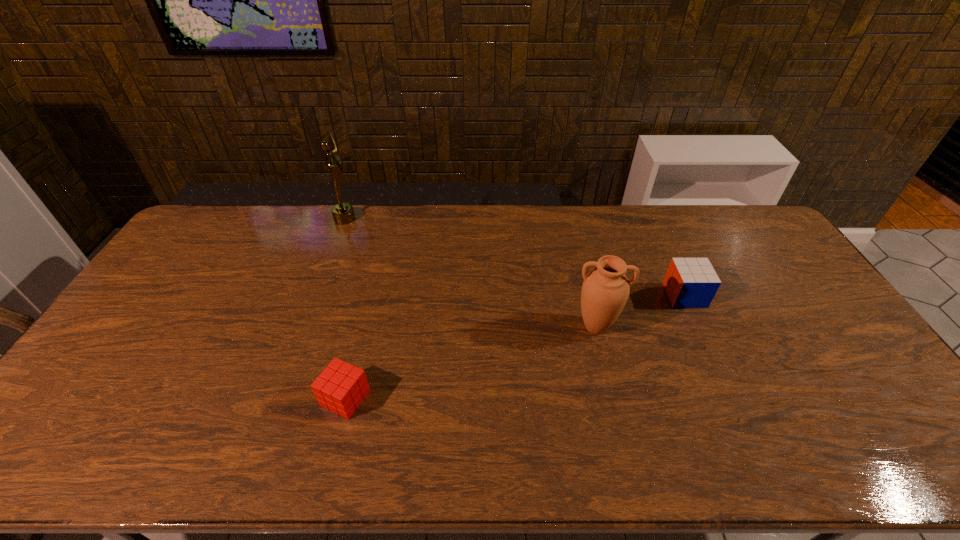
This screenshot has width=960, height=540. I want to click on the tallest object, so click(x=343, y=213).

Where is `the farthest object`? the farthest object is located at coordinates (343, 213).

This screenshot has width=960, height=540. What are the coordinates of `the third object from left to right` in the screenshot? It's located at (605, 290).

Where is `the third shortest object`? the third shortest object is located at coordinates (605, 290).

You are a GUI agent. You are given a task and a screenshot of the screen. Output one action in this format:
    pyautogui.click(x=<x>, y=<y>)
    Task: Click on the third nearest object
    This screenshot has width=960, height=540.
    Given the screenshot: What is the action you would take?
    pyautogui.click(x=689, y=282)

You are a GUI agent. You are given a task and a screenshot of the screen. Output one action in this format:
    pyautogui.click(x=<x>, y=<y>)
    Task: Click on the rightmost object
    This screenshot has height=540, width=960.
    Given the screenshot: What is the action you would take?
    pyautogui.click(x=689, y=282)

Identify the location of the third object from right to left. The image size is (960, 540). (341, 387).

This screenshot has width=960, height=540. What are the coordinates of `the nearest object` in the screenshot? It's located at (341, 387).

Identify the location of vacant space located 0.090m on the front-facing side of the farthest object. (379, 219).

I want to click on blank area located on the back of the urn, so click(584, 279).